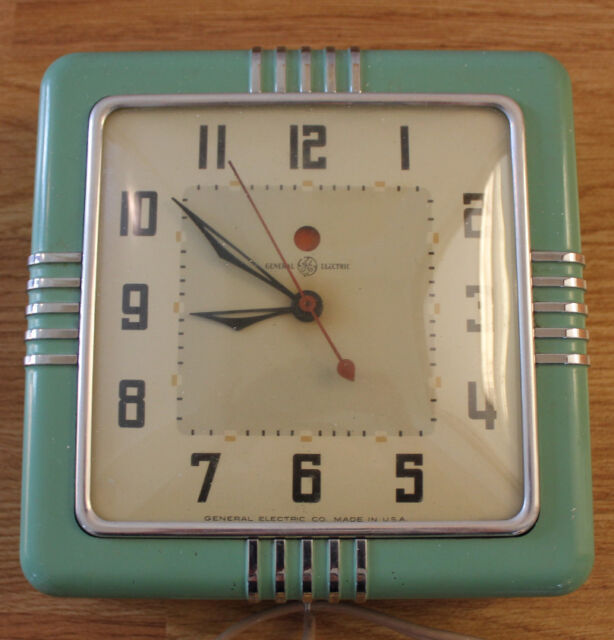
Where is `wooden table`? This screenshot has width=614, height=640. wooden table is located at coordinates (61, 610), (10, 292), (595, 159), (376, 19).